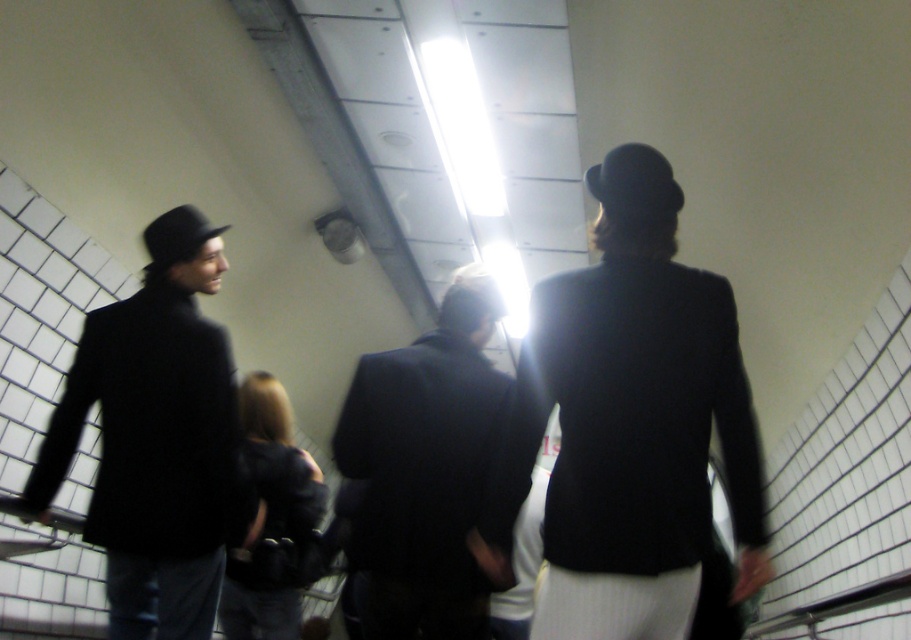
You are standing at the entrance of the subway passage and see two points marked in the scene. Which point is closer to you, point (132,490) or point (219,605)?

Point (132,490) is in front of point (219,605), so it is closer to you.

You are standing in the subway passage and notice a matte black blazer at center. Based on its position, can you determine if it is closer to the left or right side of the passage?

The matte black blazer at center is located at point 0.656 on the x and 0.698 on the y, so it is closer to the right side of the passage.

You are a delivery person carrying a box that is 20 inches long. You need to walk through the subway passage and pass between the matte black coat at left and the black leather jacket at center. Can you fit through the space between them without tilting the box?

The distance between the matte black coat at left and the black leather jacket at center is 18.76 inches. Since your box is 20 inches long, it is longer than the available space, so you cannot fit through the space between them without tilting the box.